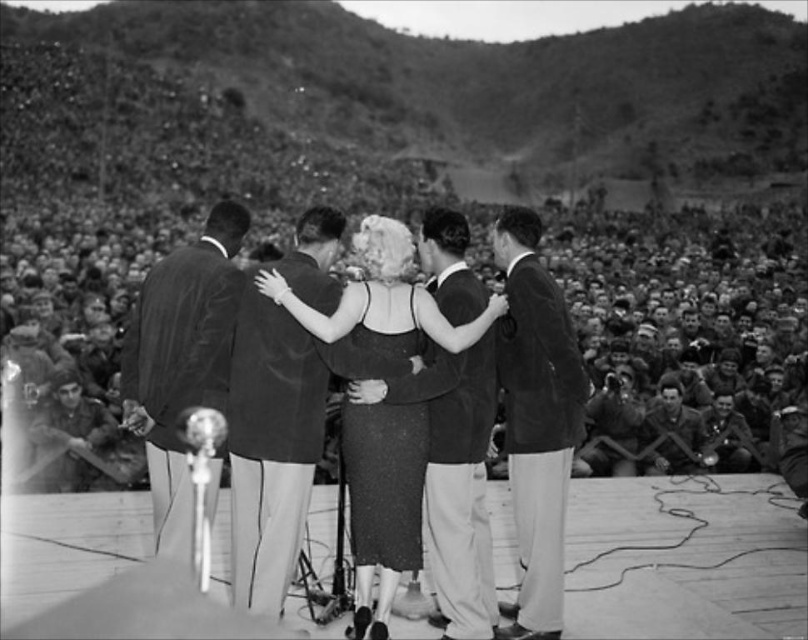
You are a photographer at the event and need to capture a shot where both the dark wool suit at center and the suede jacket at right are visible. Based on their positions, which one should you ensure is closer to the left side of your camera frame?

The dark wool suit at center is to the left of the suede jacket at right, so to ensure both are visible, the dark wool suit at center should be positioned on the left side of the frame.

Based on the photo, you are a photographer trying to capture the central figure in the image. The dark gray uniformed crowd at center is blocking your view. Where should you position yourself to avoid them?

The dark gray uniformed crowd at center is located at point (686, 314). To avoid them, position yourself to the left or right of this coordinate to capture the central figure without obstruction.

You are a photographer at the event and want to capture the dark gray uniformed crowd at center and the dark wool suit at center in the same frame. Based on their positions, which one should be placed on the left side of your photo?

The dark gray uniformed crowd at center should be placed on the left side of the photo because it is located to the left of the dark wool suit at center.